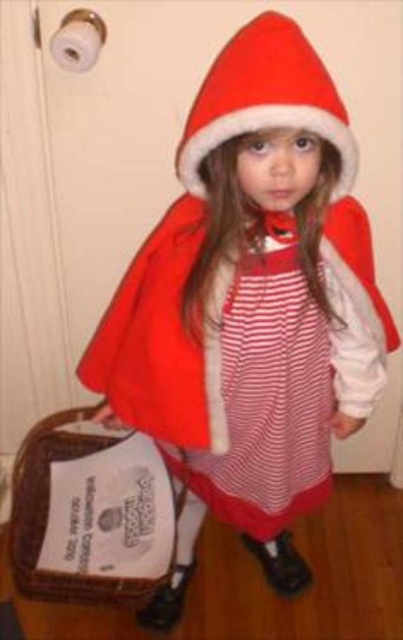
What are the coordinates of the red striped dress at center?

The red striped dress at center is located at point (x=265, y=401).

You are a tailor measuring the distance between two items on a mannequin. The items are the red striped dress at center and the red velvet santa hat at center. The minimum space required between them for a safety pin is 10 inches. Can you safely secure them with a safety pin?

The distance between the red striped dress at center and the red velvet santa hat at center is 12.71 inches, which exceeds the 10 inches required for the safety pin. Therefore, you can safely secure them with a safety pin.